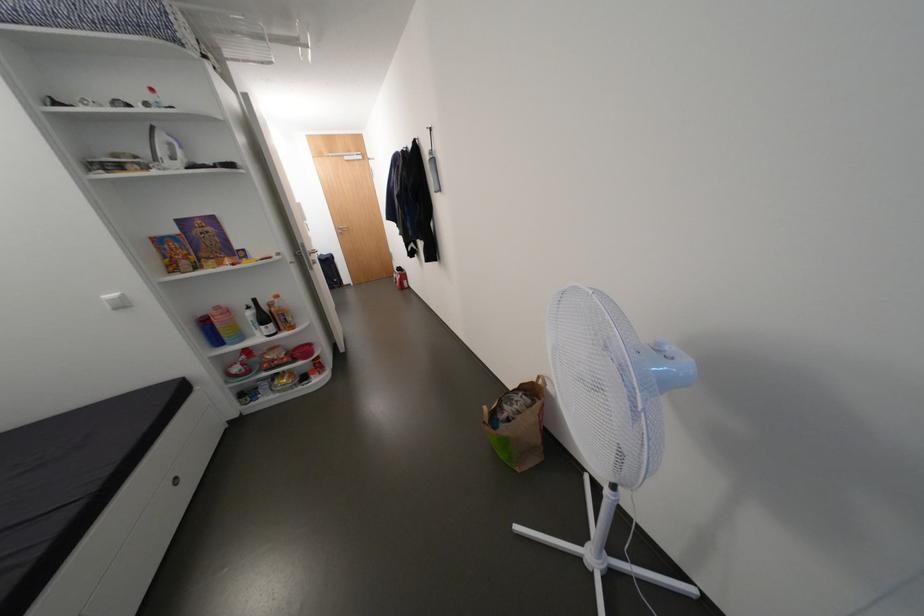
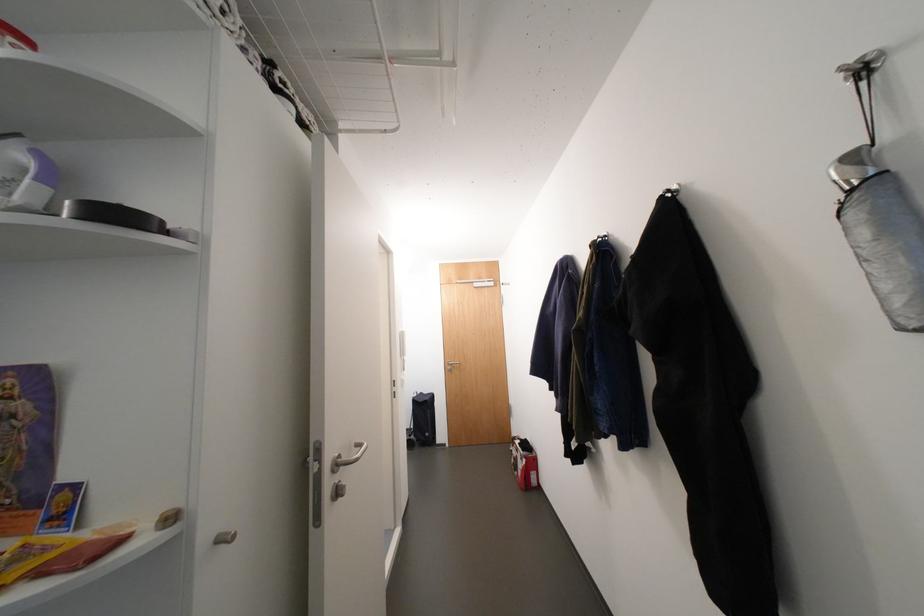
Where in the second image is the point corresponding to point (334, 259) from the first image?

(433, 402)